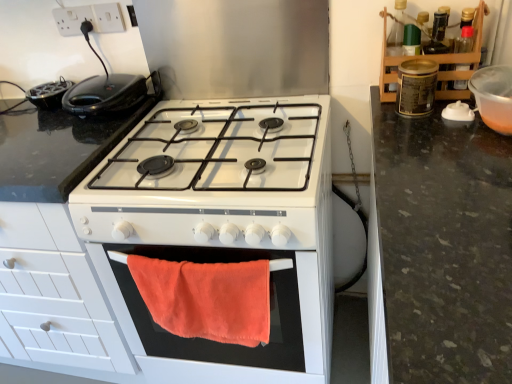
Question: Considering the positions of orange fabric towel at center and metallic canister at upper right, acting as the 3th appliance starting from the left, in the image, is orange fabric towel at center bigger or smaller than metallic canister at upper right, acting as the 3th appliance starting from the left,?

Choices:
 (A) big
 (B) small

Answer: (A)

Question: Visually, is orange fabric towel at center positioned to the left or to the right of metallic canister at upper right, acting as the 3th appliance starting from the left?

Choices:
 (A) left
 (B) right

Answer: (A)

Question: Which object is the closest to the black plastic sandwich maker at upper left?

Choices:
 (A) white glossy gas stove at center
 (B) metallic canister at upper right, which is the 2th appliance from right to left
 (C) orange fabric towel at center
 (D) white plastic socket at upper left, which is the first electric outlet from left to right
 (E) transparent plastic bowl at upper right, which is counted as the 4th appliance, starting from the left

Answer: (D)

Question: Which object is the farthest from the white plastic socket at upper left, which appears as the first electric outlet when viewed from the right?

Choices:
 (A) black plastic toaster at upper left, marked as the 1th appliance in a left-to-right arrangement
 (B) metallic canister at upper right, which is the 2th appliance from right to left
 (C) white glossy gas stove at center
 (D) orange fabric towel at center
 (E) black plastic sandwich maker at upper left

Answer: (D)